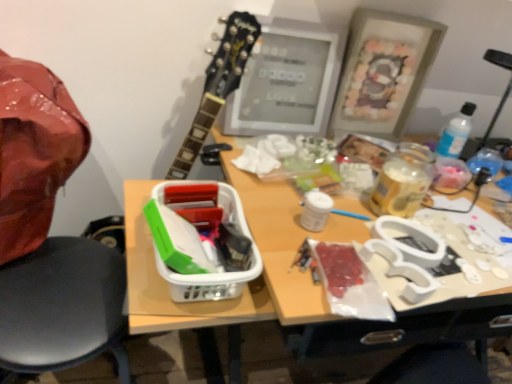
The image size is (512, 384). In order to click on empty space that is ontop of white plastic lunch box at center (from a real-world perspective) in this screenshot , I will do `click(190, 211)`.